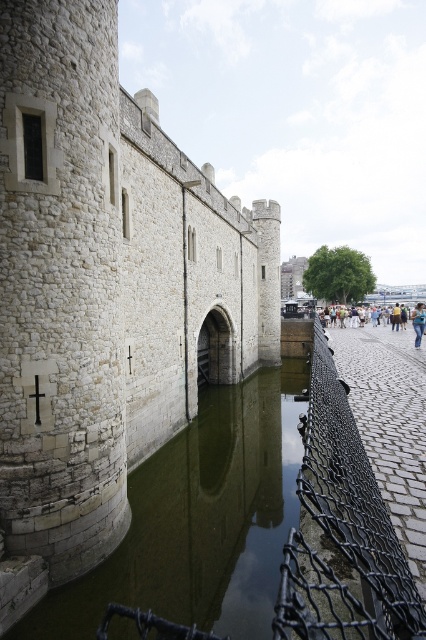
Is point (222, 566) more distant than point (417, 339)?

No, it is in front of (417, 339).

Between point (88, 579) and point (419, 321), which one is positioned behind?

The point (419, 321) is more distant.

Where is `greenish stone waterway at center`? The height and width of the screenshot is (640, 426). greenish stone waterway at center is located at coordinates (201, 520).

This screenshot has height=640, width=426. I want to click on greenish stone waterway at center, so click(x=201, y=520).

Is black chain-link fence at lower right behind blue denim jeans at center?

No, black chain-link fence at lower right is closer to the viewer.

I want to click on black chain-link fence at lower right, so click(x=342, y=531).

Who is shorter, greenish stone waterway at center or black chain-link fence at lower right?

Standing shorter between the two is greenish stone waterway at center.

Locate an element on the screen. This screenshot has width=426, height=640. greenish stone waterway at center is located at coordinates click(x=201, y=520).

At what (x,y) coordinates should I click in order to perform the action: click on greenish stone waterway at center. Please return your answer as a coordinate pair (x, y). The height and width of the screenshot is (640, 426). Looking at the image, I should click on (201, 520).